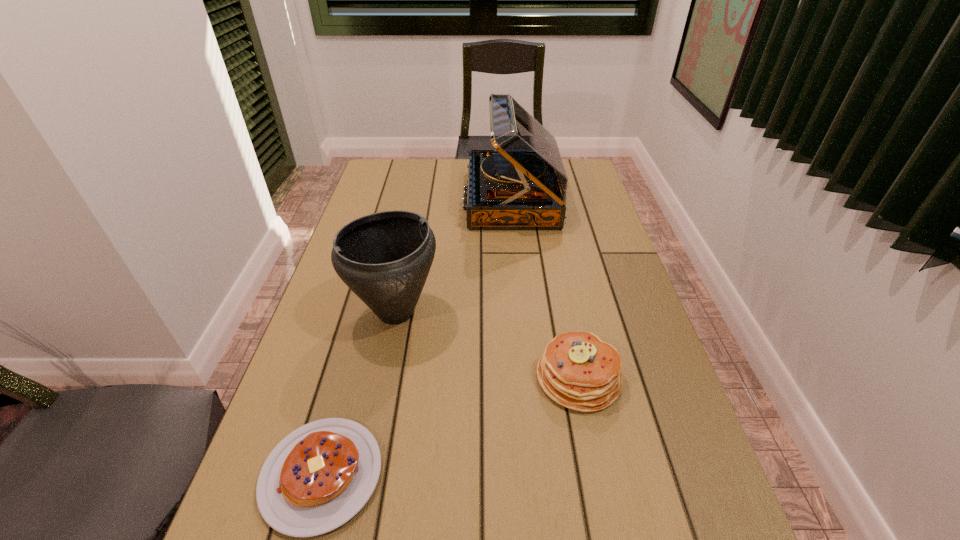
Locate an element on the screen. the tallest object is located at coordinates (522, 184).

Locate an element on the screen. the farthest object is located at coordinates (522, 184).

Identify the location of urn. The width and height of the screenshot is (960, 540). (384, 258).

In order to click on the right pancake in this screenshot , I will do point(579,371).

You are a GUI agent. You are given a task and a screenshot of the screen. Output one action in this format:
    pyautogui.click(x=<x>, y=<y>)
    Task: Click on the farther pancake
    This screenshot has height=540, width=960.
    Given the screenshot: What is the action you would take?
    pyautogui.click(x=579, y=371)

This screenshot has width=960, height=540. I want to click on free space located on the front-facing side of the record player, so click(419, 198).

The width and height of the screenshot is (960, 540). I want to click on vacant space located 0.240m on the front-facing side of the record player, so click(396, 198).

Locate an element on the screen. This screenshot has width=960, height=540. free space located 0.110m on the front-facing side of the record player is located at coordinates (433, 198).

Identify the location of blank space located on the right of the urn. The image size is (960, 540). [x=558, y=312].

Where is `free space located on the left of the right pancake`? The height and width of the screenshot is (540, 960). free space located on the left of the right pancake is located at coordinates (500, 377).